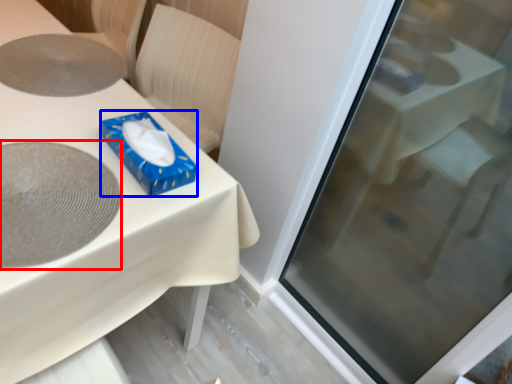
Question: Which point is further to the camera, oval (highlighted by a red box) or box (highlighted by a blue box)?

Choices:
 (A) oval
 (B) box

Answer: (B)